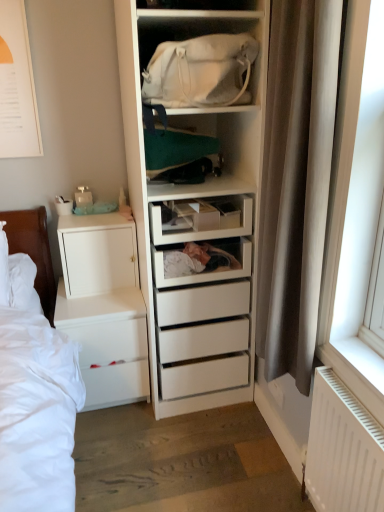
Identify the location of free point below brown fabric curtain at right (from a real-world perspective). Image resolution: width=384 pixels, height=512 pixels. pyautogui.click(x=258, y=463).